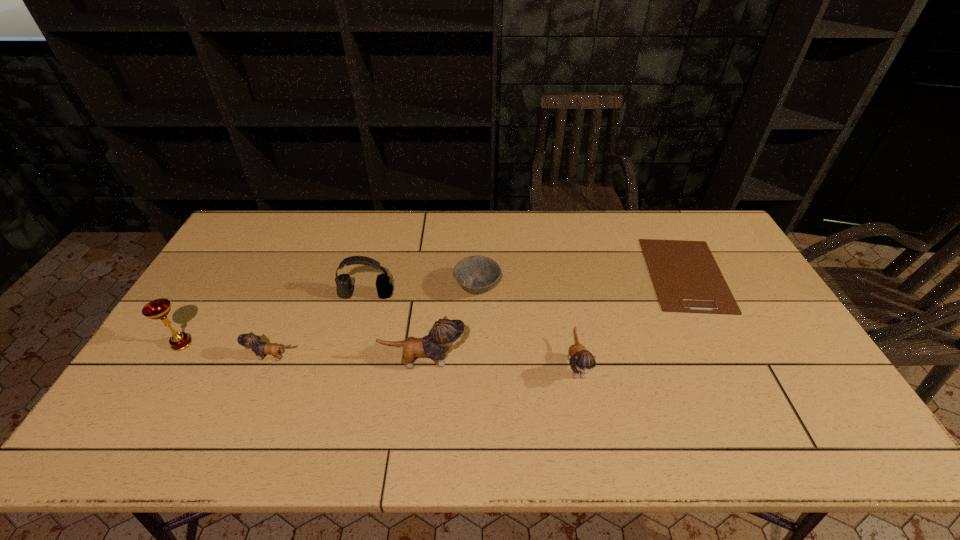
The kittens are evenly distributed in the image. To maintain this, where would you place another kitten on the right? Please point to a free space. Please provide its 2D coordinates. Your answer should be formatted as a tuple, i.e. [(x, y)], where the tuple contains the x and y coordinates of a point satisfying the conditions above.

[(732, 370)]